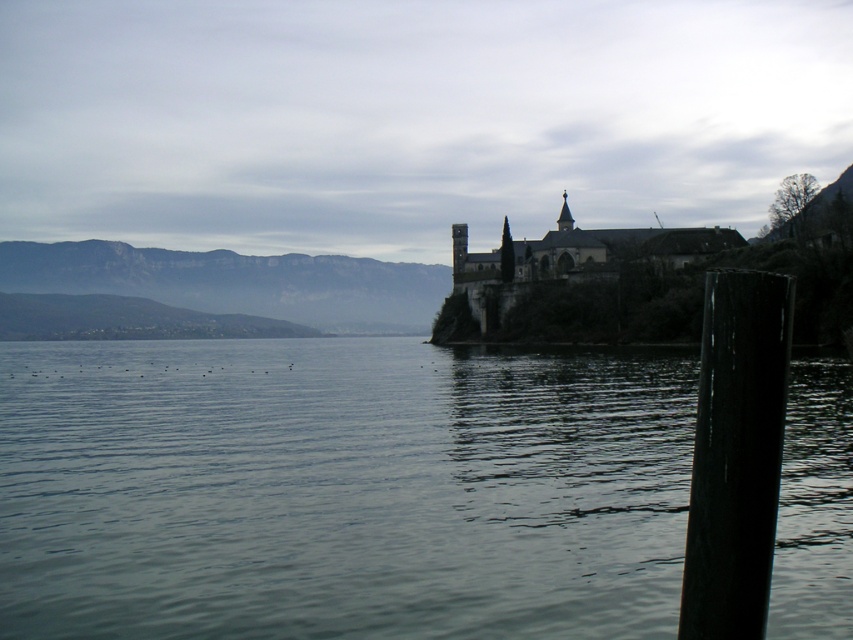
Between smooth dark water at center and black smooth pole at right, which one is positioned higher?

black smooth pole at right is above.

Between smooth dark water at center and black smooth pole at right, which one has less height?

black smooth pole at right is shorter.

Describe the element at coordinates (339, 490) in the screenshot. I see `smooth dark water at center` at that location.

Find the location of `smooth dark water at center`. smooth dark water at center is located at coordinates (339, 490).

In the scene shown: Is black smooth pole at right positioned at the back of dark stone castle at center?

No, it is in front of dark stone castle at center.

Measure the distance between black smooth pole at right and dark stone castle at center.

The distance of black smooth pole at right from dark stone castle at center is 147.48 meters.

What do you see at coordinates (735, 454) in the screenshot?
I see `black smooth pole at right` at bounding box center [735, 454].

Locate an element on the screen. This screenshot has height=640, width=853. black smooth pole at right is located at coordinates (735, 454).

Is point (805, 435) behind point (497, 269)?

No, (805, 435) is closer to viewer.

Between smooth dark water at center and dark stone castle at center, which one is positioned higher?

Positioned higher is dark stone castle at center.

Describe the element at coordinates (339, 490) in the screenshot. I see `smooth dark water at center` at that location.

Find the location of a particular element. Image resolution: width=853 pixels, height=640 pixels. smooth dark water at center is located at coordinates (339, 490).